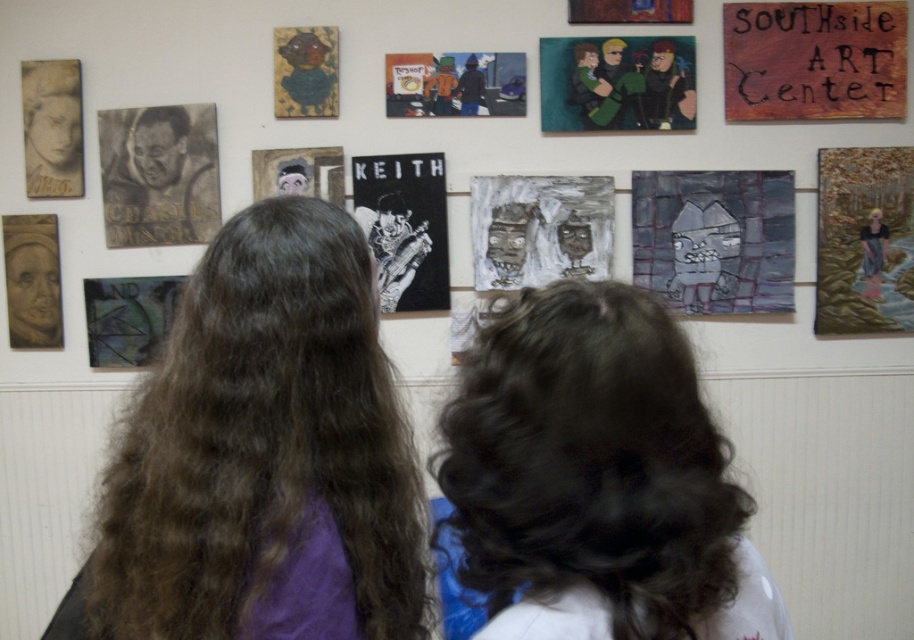
Between point (527, 317) and point (863, 58), which one is positioned in front?

Point (527, 317) is in front.

Is point (524, 532) more distant than point (748, 58)?

No, it is not.

Where is `dark curly hair at center`? The image size is (914, 640). dark curly hair at center is located at coordinates (590, 461).

Is black paper keith at center wider than matte orange jacket at center?

Incorrect, black paper keith at center's width does not surpass matte orange jacket at center's.

Does black paper keith at center appear on the right side of matte orange jacket at center?

In fact, black paper keith at center is to the left of matte orange jacket at center.

Between point (413, 275) and point (498, 61), which one is positioned behind?

Point (413, 275)

Where is `black paper keith at center`? black paper keith at center is located at coordinates (404, 227).

Based on the photo, measure the distance from textured gray painting of two faces at center to golden hair at upper right.

textured gray painting of two faces at center and golden hair at upper right are 38.42 inches apart from each other.

Can you confirm if textured gray painting of two faces at center is positioned to the right of golden hair at upper right?

In fact, textured gray painting of two faces at center is to the left of golden hair at upper right.

This screenshot has width=914, height=640. What are the coordinates of `textured gray painting of two faces at center` in the screenshot? It's located at (539, 228).

Locate an element on the screen. textured gray painting of two faces at center is located at coordinates (539, 228).